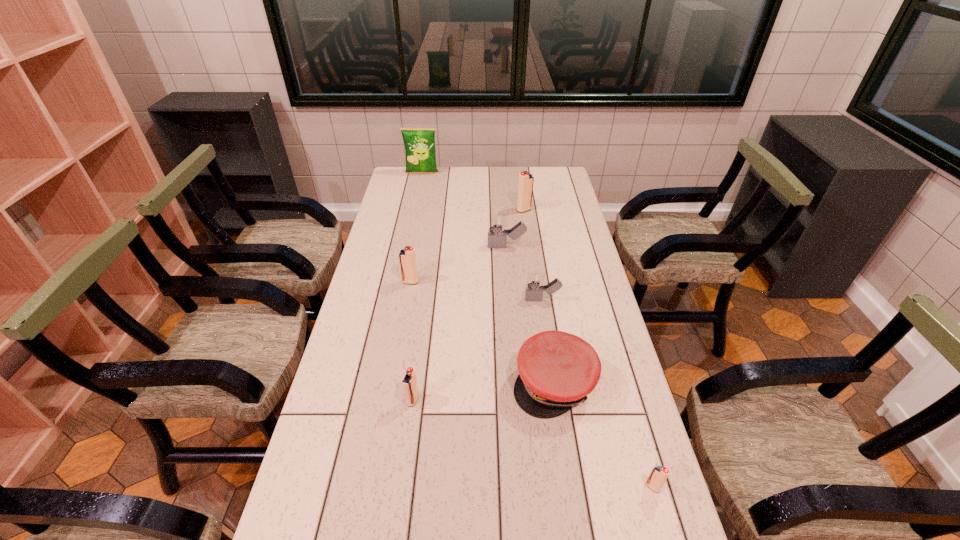
In the image, there is a desktop. Identify the location of free region at the right edge. (541, 210).

The height and width of the screenshot is (540, 960). I want to click on blank space at the far left corner, so click(408, 188).

The height and width of the screenshot is (540, 960). Identify the location of vacant space at the far right corner of the desktop. (548, 189).

Identify the location of free space between the farthest object and the third red igniter from left to right. (473, 192).

Where is `free space between the third biggest red igniter and the eighth nearest object`? The height and width of the screenshot is (540, 960). free space between the third biggest red igniter and the eighth nearest object is located at coordinates (468, 305).

I want to click on empty location between the second nearest red igniter and the red cap, so click(x=483, y=392).

You are a GUI agent. You are given a task and a screenshot of the screen. Output one action in this format:
    pyautogui.click(x=<x>, y=<y>)
    Task: Click on the empty space that is in between the tallest object and the biggest gray igniter
    The height and width of the screenshot is (540, 960).
    Given the screenshot: What is the action you would take?
    pyautogui.click(x=465, y=210)

Where is `free space between the rightmost igniter and the red cap`? free space between the rightmost igniter and the red cap is located at coordinates (603, 435).

The image size is (960, 540). Identify the location of object that can be found as the eighth closest to the leftmost igniter. (659, 474).

Identify the location of object that is the seventh nearest to the biggest red igniter. The image size is (960, 540). (659, 474).